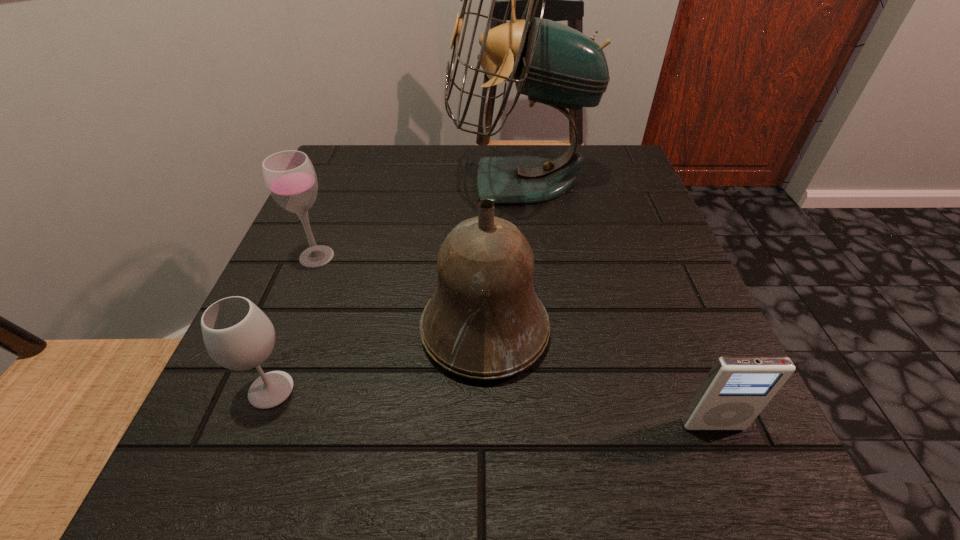
Locate an element on the screen. The image size is (960, 540). vacant region at the left edge of the desktop is located at coordinates (345, 273).

Image resolution: width=960 pixels, height=540 pixels. In the image, there is a desktop. In order to click on free region at the right edge in this screenshot , I will do `click(624, 366)`.

You are a GUI agent. You are given a task and a screenshot of the screen. Output one action in this format:
    pyautogui.click(x=<x>, y=<y>)
    Task: Click on the vacant region at the far left corner
    Image resolution: width=960 pixels, height=540 pixels.
    Given the screenshot: What is the action you would take?
    [376, 192]

This screenshot has height=540, width=960. Find the location of `free space at the near left corner of the desktop`. free space at the near left corner of the desktop is located at coordinates (301, 458).

Where is `vacant area at the far right corner`? vacant area at the far right corner is located at coordinates (611, 194).

Identify the location of empty space that is in between the nearer wineglass and the second tallest object. Image resolution: width=960 pixels, height=540 pixels. (378, 360).

This screenshot has width=960, height=540. I want to click on free point between the second tallest object and the fourth nearest object, so click(400, 293).

The height and width of the screenshot is (540, 960). I want to click on vacant point located between the nearest object and the nearer wineglass, so click(x=492, y=407).

Find the location of a particular element. The image size is (960, 540). unoccupied position between the iPod and the tallest object is located at coordinates (616, 303).

Identify the location of unoccupied position between the nearer wineglass and the farther wineglass. point(294,323).